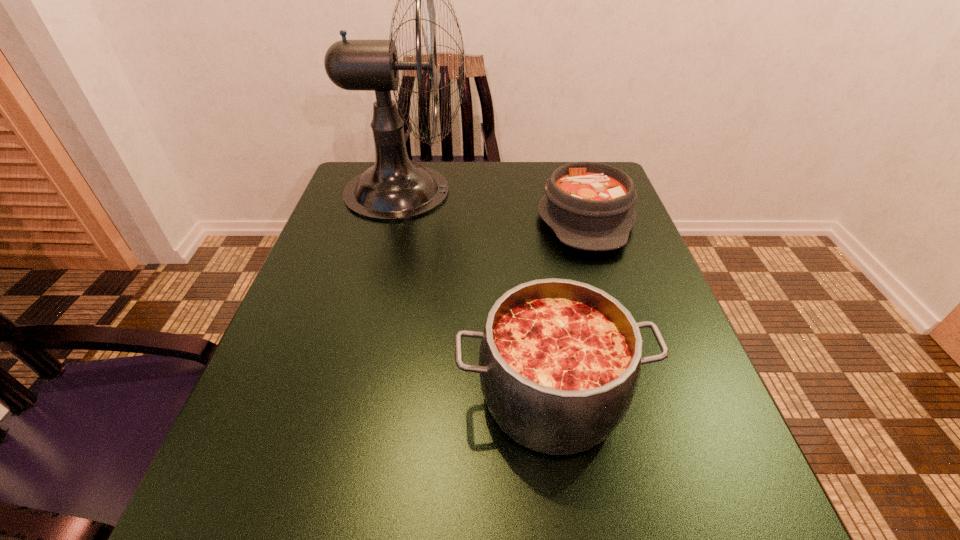
Locate an element on the screen. This screenshot has height=540, width=960. the tallest object is located at coordinates (394, 188).

The width and height of the screenshot is (960, 540). I want to click on the nearer casserole, so click(559, 361).

Identify the location of the taller casserole. Image resolution: width=960 pixels, height=540 pixels. (559, 361).

The height and width of the screenshot is (540, 960). Find the location of `the shorter casserole`. the shorter casserole is located at coordinates (589, 205).

The image size is (960, 540). Identify the location of the farther casserole. (589, 205).

The image size is (960, 540). I want to click on free space located 0.130m on the front-facing side of the fan, so click(518, 191).

Identify the location of vacant space located 0.390m on the back of the second shortest object. (526, 213).

Locate an element on the screen. vacant region located on the left of the shorter casserole is located at coordinates (516, 219).

Where is `fan situated at the far edge`? This screenshot has height=540, width=960. fan situated at the far edge is located at coordinates (394, 188).

Identify the location of casserole located in the far edge section of the desktop. The image size is (960, 540). (589, 205).